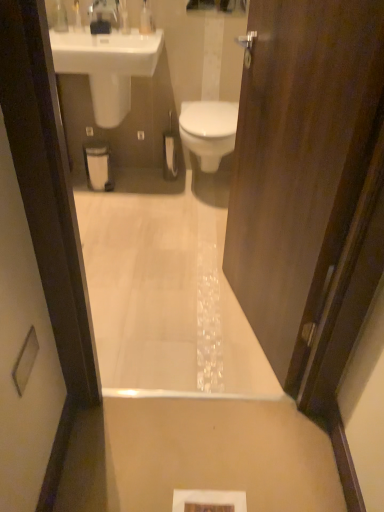
Question: Is white glossy bath at center closer to the viewer compared to white glossy sink at upper left?

Choices:
 (A) no
 (B) yes

Answer: (B)

Question: Is white glossy bath at center oriented away from white glossy sink at upper left?

Choices:
 (A) no
 (B) yes

Answer: (A)

Question: From the image's perspective, is white glossy bath at center over white glossy sink at upper left?

Choices:
 (A) no
 (B) yes

Answer: (A)

Question: Considering the relative sizes of white glossy bath at center and white glossy sink at upper left in the image provided, is white glossy bath at center smaller than white glossy sink at upper left?

Choices:
 (A) yes
 (B) no

Answer: (A)

Question: Considering the relative sizes of white glossy bath at center and white glossy sink at upper left in the image provided, is white glossy bath at center shorter than white glossy sink at upper left?

Choices:
 (A) yes
 (B) no

Answer: (A)

Question: Is white glossy bath at center taller than white glossy sink at upper left?

Choices:
 (A) yes
 (B) no

Answer: (B)

Question: Is white glossy sink at upper left completely or partially inside clear plastic bottle at upper left, which appears as the third toiletry when viewed from the right?

Choices:
 (A) no
 (B) yes

Answer: (A)

Question: Does clear plastic bottle at upper left, placed as the 1th toiletry when sorted from left to right, appear on the right side of white glossy sink at upper left?

Choices:
 (A) no
 (B) yes

Answer: (A)

Question: Is clear plastic bottle at upper left, placed as the 1th toiletry when sorted from left to right, further to camera compared to white glossy sink at upper left?

Choices:
 (A) no
 (B) yes

Answer: (B)

Question: Are clear plastic bottle at upper left, which appears as the third toiletry when viewed from the right, and white glossy sink at upper left beside each other?

Choices:
 (A) yes
 (B) no

Answer: (B)

Question: Is clear plastic bottle at upper left, which appears as the third toiletry when viewed from the right, taller than white glossy sink at upper left?

Choices:
 (A) no
 (B) yes

Answer: (A)

Question: Considering the relative positions of clear plastic bottle at upper left, placed as the 1th toiletry when sorted from left to right, and white glossy sink at upper left in the image provided, is clear plastic bottle at upper left, placed as the 1th toiletry when sorted from left to right, to the left of white glossy sink at upper left from the viewer's perspective?

Choices:
 (A) yes
 (B) no

Answer: (A)

Question: Can we say translucent plastic soap dispenser at upper center, the 2th toiletry viewed from the left, lies outside clear plastic bottle at upper left, which appears as the third toiletry when viewed from the right?

Choices:
 (A) yes
 (B) no

Answer: (A)